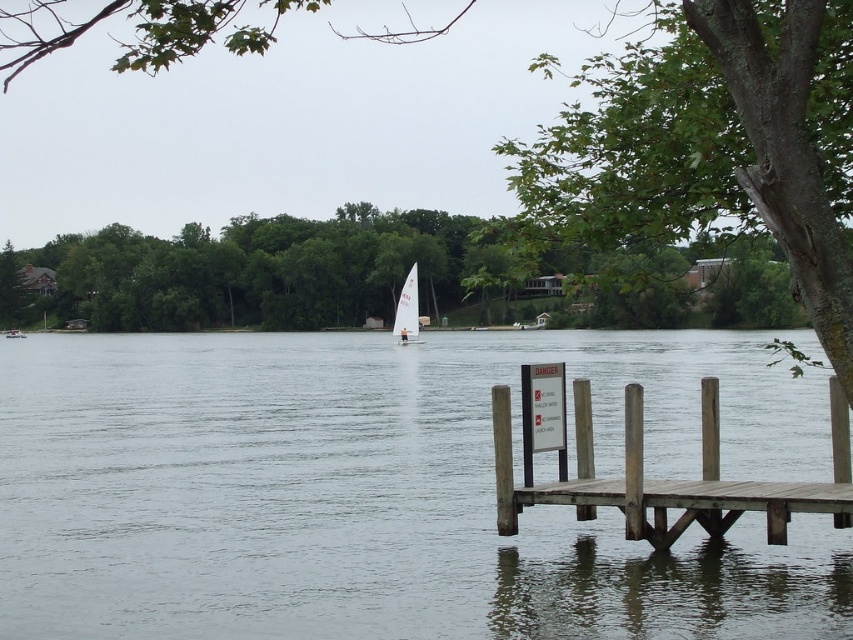
You are standing on the brown wooden dock at lower right and want to reach the white sailboat at center. Considering their sizes, which one would appear closer to you when you look towards the boat?

The brown wooden dock at lower right is smaller in size compared to the white sailboat at center, so the sailboat would appear closer to you when looking towards it.

You are standing on the wooden dock and looking towards the lake. You notice a green leafy tree at upper right and a white sailboat at center. Which object is higher in the scene?

The green leafy tree at upper right is positioned over the white sailboat at center, so it is higher in the scene.